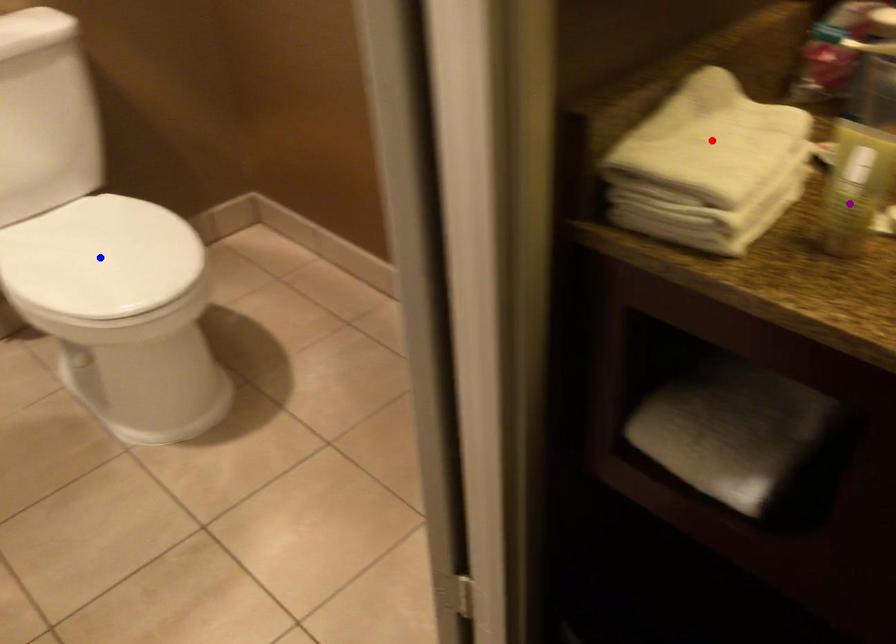
Order these from nearest to farthest:
1. red point
2. blue point
3. purple point

blue point, red point, purple point